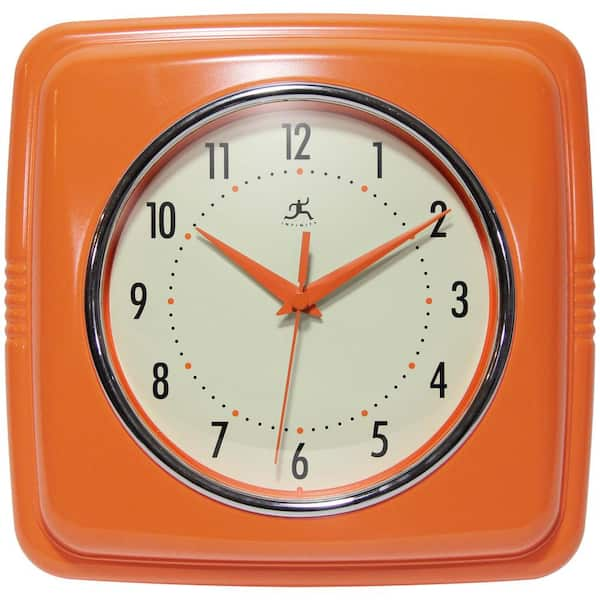
Find the location of a particular element. The height and width of the screenshot is (600, 600). off-white clock face is located at coordinates (215, 348).